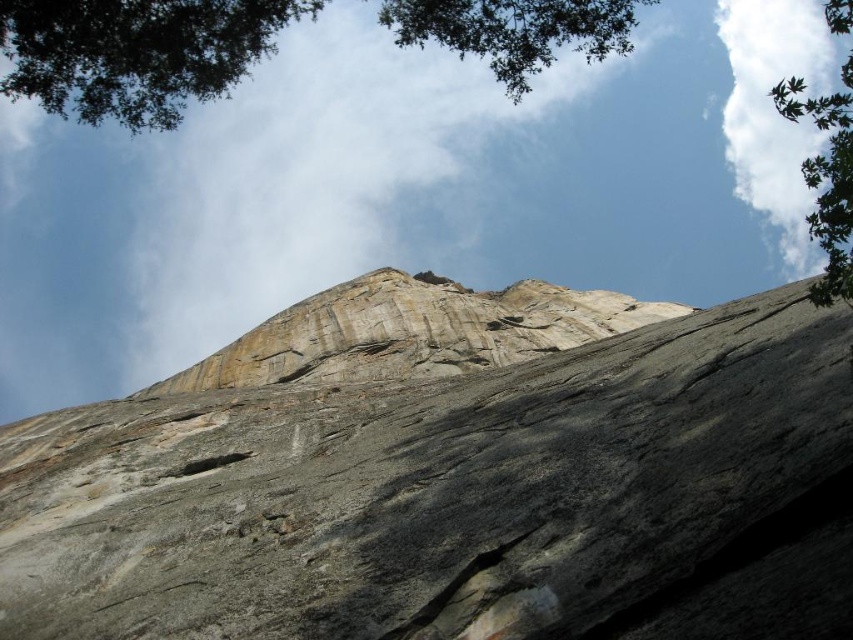
Identify the location of gray/rough rock face at center. This screenshot has height=640, width=853. (445, 474).

Is gray/rough rock face at center shorter than green leafy tree at upper center?

Indeed, gray/rough rock face at center has a lesser height compared to green leafy tree at upper center.

The height and width of the screenshot is (640, 853). In order to click on gray/rough rock face at center in this screenshot , I will do `click(445, 474)`.

The height and width of the screenshot is (640, 853). I want to click on gray/rough rock face at center, so click(445, 474).

Between green leafy tree at upper center and green leafy tree at upper right, which one is positioned higher?

green leafy tree at upper center is above.

Does green leafy tree at upper center appear on the left side of green leafy tree at upper right?

Yes, green leafy tree at upper center is to the left of green leafy tree at upper right.

The image size is (853, 640). Identify the location of green leafy tree at upper center. (136, 52).

Image resolution: width=853 pixels, height=640 pixels. Find the location of `green leafy tree at upper center`. green leafy tree at upper center is located at coordinates (136, 52).

Can you confirm if gray/rough rock face at center is positioned to the left of green leafy tree at upper right?

Correct, you'll find gray/rough rock face at center to the left of green leafy tree at upper right.

This screenshot has width=853, height=640. I want to click on gray/rough rock face at center, so click(x=445, y=474).

Where is `gray/rough rock face at center`? Image resolution: width=853 pixels, height=640 pixels. gray/rough rock face at center is located at coordinates (445, 474).